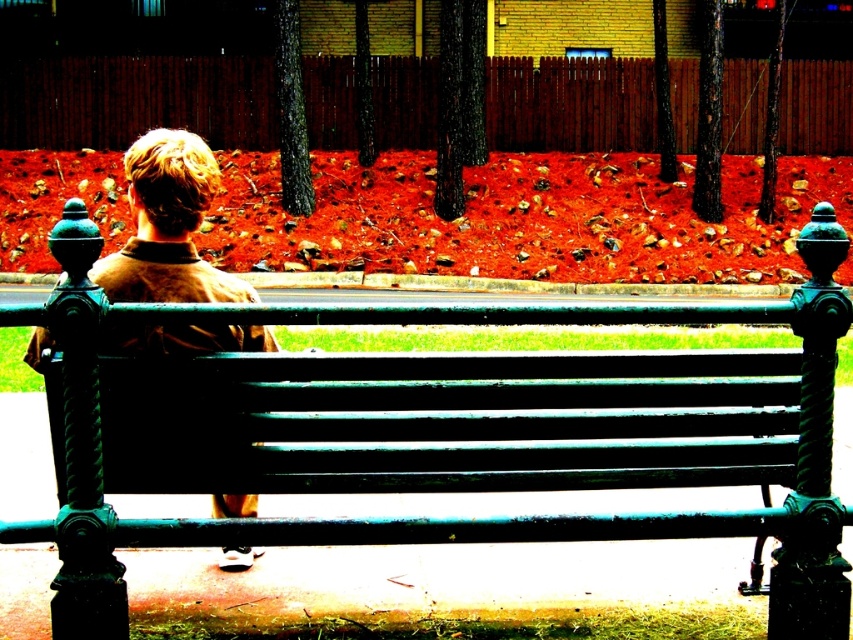
Question: Does green painted wood bench at center lie behind brown woolen jacket at center?

Choices:
 (A) no
 (B) yes

Answer: (A)

Question: Which point is closer to the camera?

Choices:
 (A) green painted wood bench at center
 (B) brown woolen jacket at center

Answer: (A)

Question: Is green painted wood bench at center above brown woolen jacket at center?

Choices:
 (A) yes
 (B) no

Answer: (B)

Question: Which point is closer to the camera?

Choices:
 (A) green painted wood bench at center
 (B) brown woolen jacket at center

Answer: (A)

Question: Does green painted wood bench at center have a lesser width compared to brown woolen jacket at center?

Choices:
 (A) yes
 (B) no

Answer: (B)